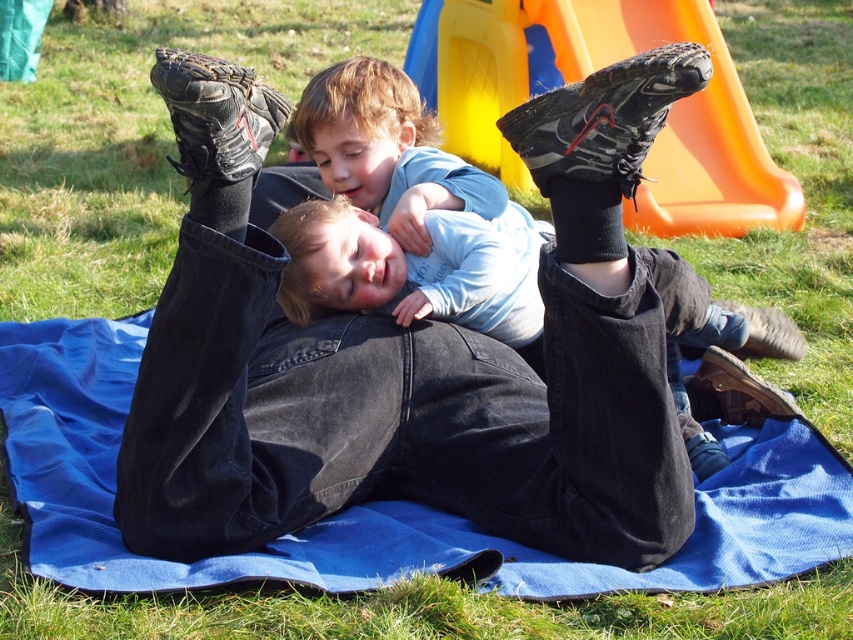
Can you confirm if blue fabric blanket at center is wider than orange plastic slide at upper center?

Yes, blue fabric blanket at center is wider than orange plastic slide at upper center.

Is blue fabric blanket at center smaller than orange plastic slide at upper center?

Correct, blue fabric blanket at center occupies less space than orange plastic slide at upper center.

The image size is (853, 640). Find the location of `blue fabric blanket at center`. blue fabric blanket at center is located at coordinates [374, 500].